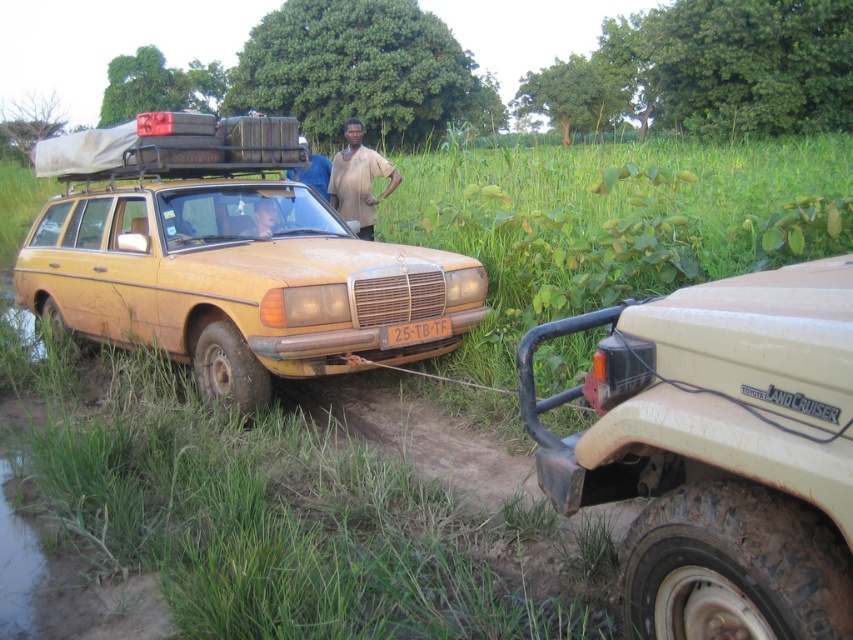
Question: Which point is farther to the camera?

Choices:
 (A) (352, 218)
 (B) (192, 308)

Answer: (A)

Question: Does beige matte/rough toyota landcruiser at right have a larger size compared to yellow matte license plate at center?

Choices:
 (A) no
 (B) yes

Answer: (B)

Question: Does brown cotton shirt at center appear on the right side of blue fabric shirt at center?

Choices:
 (A) yes
 (B) no

Answer: (A)

Question: Is brown cotton shirt at center thinner than blue fabric shirt at center?

Choices:
 (A) no
 (B) yes

Answer: (A)

Question: Which object is closer to the camera taking this photo?

Choices:
 (A) blue fabric shirt at center
 (B) beige matte/rough toyota landcruiser at right
 (C) rusty matte station wagon at center

Answer: (B)

Question: Which point is closer to the camera taking this photo?

Choices:
 (A) (344, 172)
 (B) (245, 296)
 (C) (450, 330)
 (D) (579, 324)

Answer: (D)